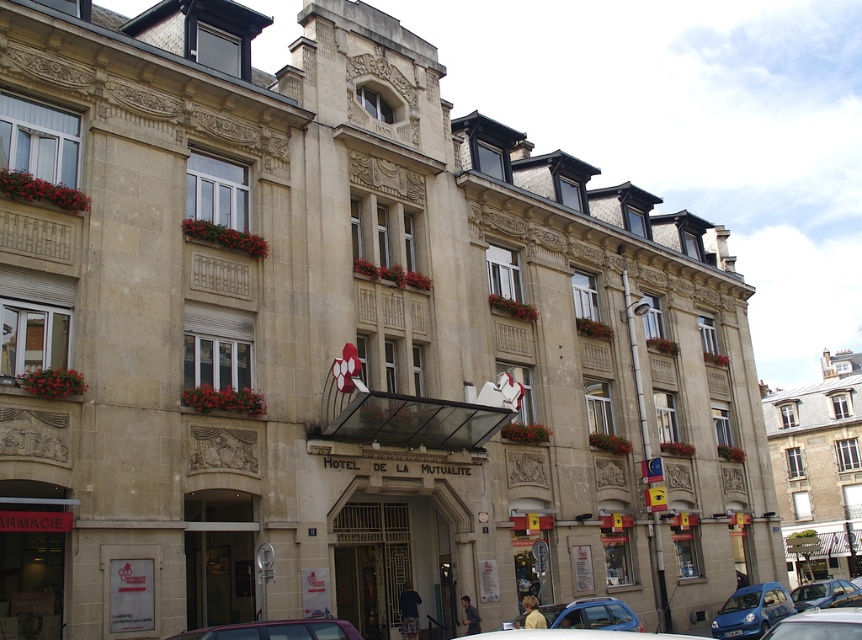
Is blue metallic car at lower right shorter than metallic silver car at center?

Indeed, blue metallic car at lower right has a lesser height compared to metallic silver car at center.

Does blue metallic car at lower right lie behind metallic silver car at center?

Yes, blue metallic car at lower right is behind metallic silver car at center.

You are a GUI agent. You are given a task and a screenshot of the screen. Output one action in this format:
    pyautogui.click(x=<x>, y=<y>)
    Task: Click on the blue metallic car at lower right
    This screenshot has width=862, height=640.
    Given the screenshot: What is the action you would take?
    pyautogui.click(x=751, y=611)

Where is `blue metallic car at lower right`? The width and height of the screenshot is (862, 640). blue metallic car at lower right is located at coordinates (751, 611).

Which is in front, point (292, 625) or point (860, 608)?

Point (292, 625)

Is metallic gray car at lower center to the left of metallic silver car at center from the viewer's perspective?

Correct, you'll find metallic gray car at lower center to the left of metallic silver car at center.

Which is behind, point (264, 637) or point (821, 612)?

The point (264, 637) is more distant.

Identify the location of metallic gray car at lower center. The height and width of the screenshot is (640, 862). (276, 630).

Is beige stone hotel at center to the right of metallic blue car at lower right from the viewer's perspective?

Yes, beige stone hotel at center is to the right of metallic blue car at lower right.

Which is in front, point (785, 444) or point (838, 588)?

Point (838, 588)

Does point (796, 481) come behind point (839, 584)?

That is True.

This screenshot has height=640, width=862. What are the coordinates of `beige stone hotel at center` in the screenshot? It's located at (817, 468).